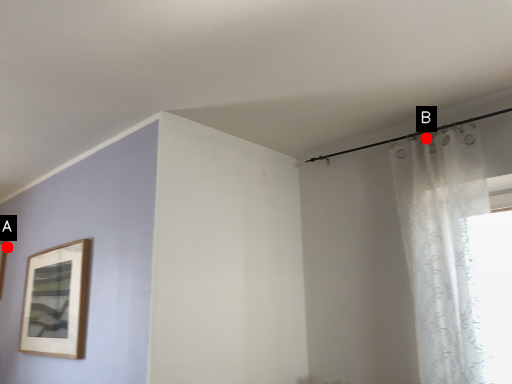
Question: Two points are circled on the image, labeled by A and B beside each circle. Which point is closer to the camera?

Choices:
 (A) A is closer
 (B) B is closer

Answer: (B)